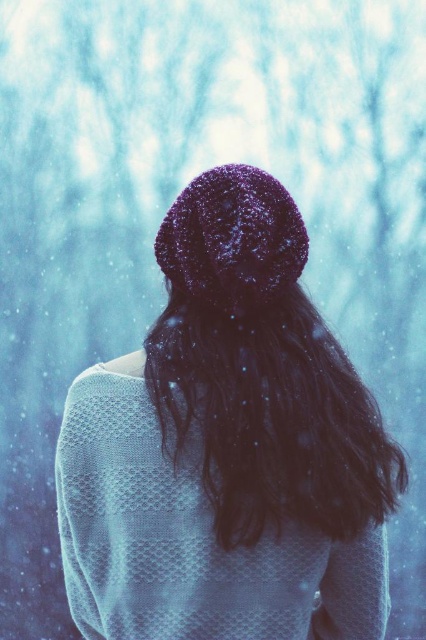
Question: Does sparkly purple knit hat at center have a larger size compared to dark matte hair at center?

Choices:
 (A) no
 (B) yes

Answer: (B)

Question: Which point is closer to the camera taking this photo?

Choices:
 (A) (219, 474)
 (B) (270, 330)

Answer: (A)

Question: Which of the following is the farthest from the observer?

Choices:
 (A) sparkly purple knit hat at center
 (B) dark matte hair at center

Answer: (A)

Question: Is sparkly purple knit hat at center further to camera compared to dark matte hair at center?

Choices:
 (A) yes
 (B) no

Answer: (A)

Question: Is sparkly purple knit hat at center further to the viewer compared to dark matte hair at center?

Choices:
 (A) no
 (B) yes

Answer: (B)